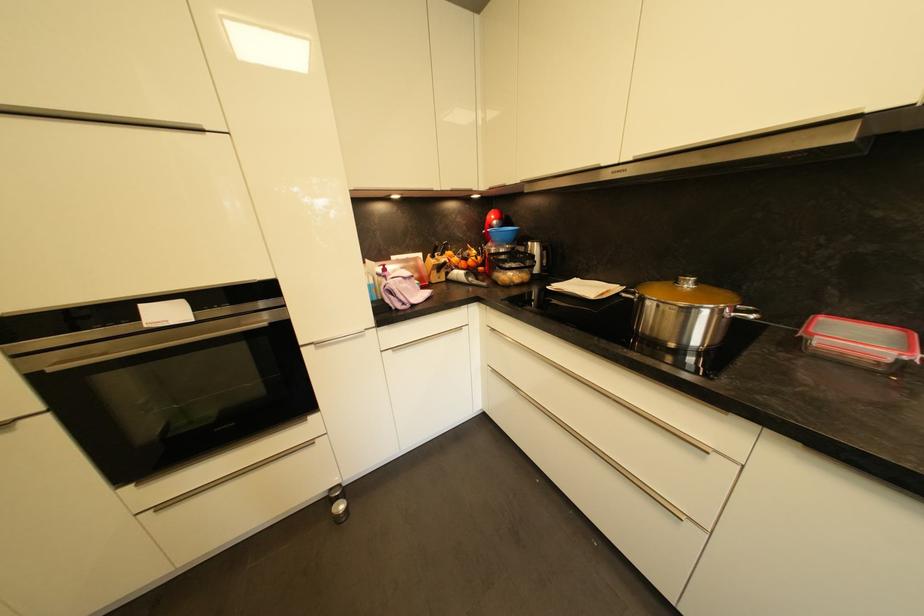
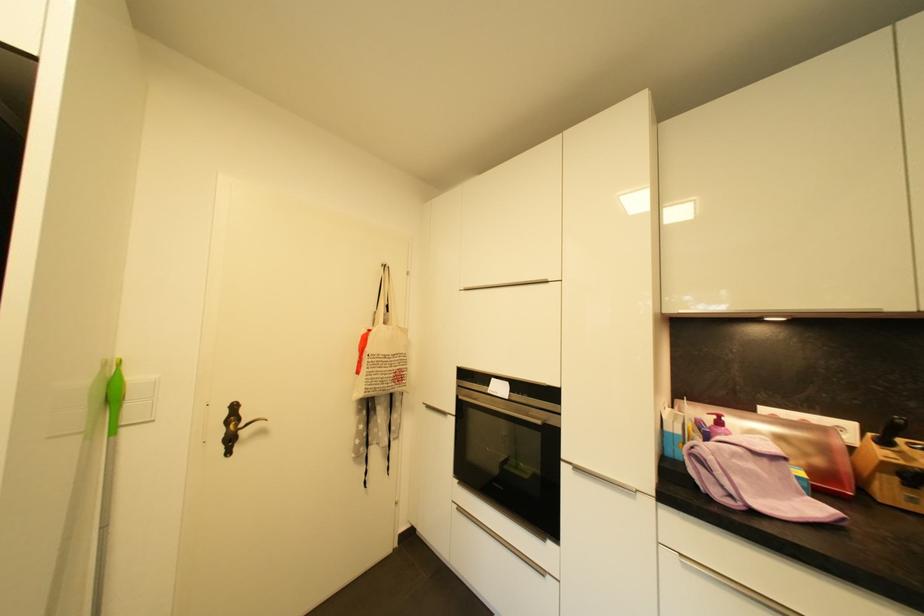
The point at (166, 509) is marked in the first image. Where is the corresponding point in the second image?

(465, 511)